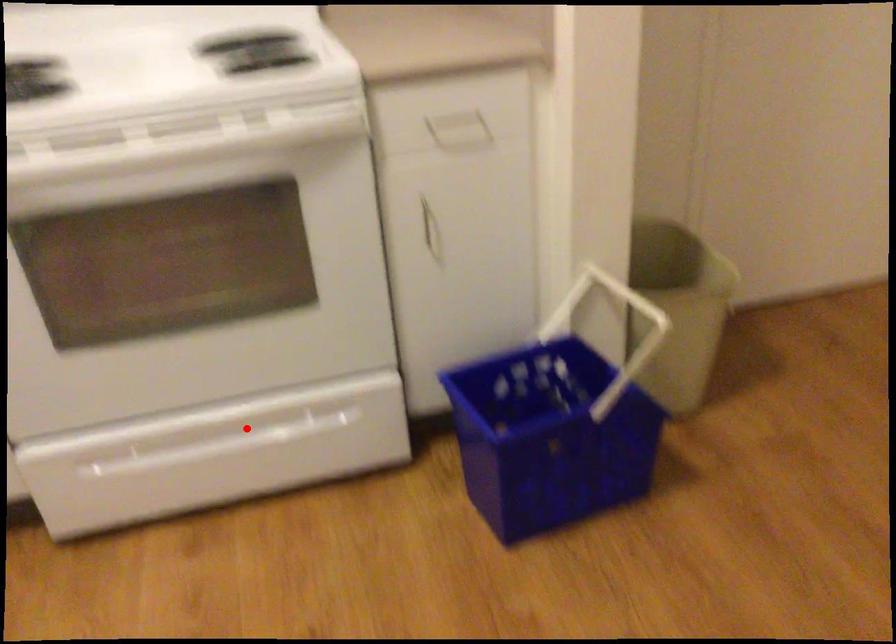
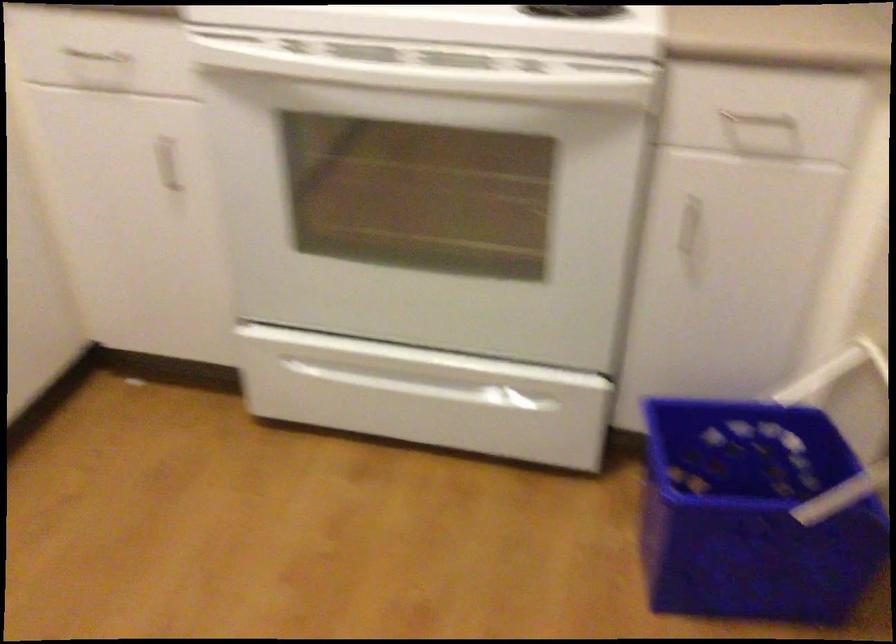
Locate, in the second image, the point that corresponds to the highlighted location in the first image.

(435, 379)